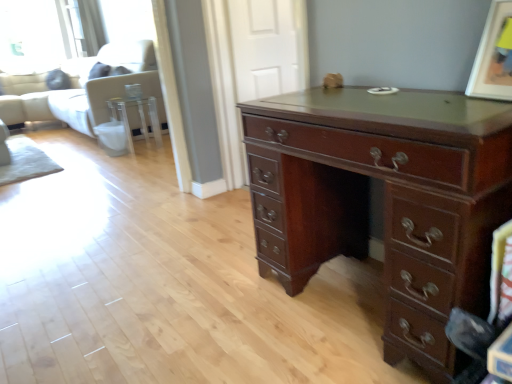
Question: Is clear glass side table at center taller than mahogany wood desk at center?

Choices:
 (A) yes
 (B) no

Answer: (B)

Question: Does clear glass side table at center have a larger size compared to mahogany wood desk at center?

Choices:
 (A) yes
 (B) no

Answer: (B)

Question: Considering the relative positions of clear glass side table at center and mahogany wood desk at center in the image provided, is clear glass side table at center behind mahogany wood desk at center?

Choices:
 (A) no
 (B) yes

Answer: (B)

Question: From the image's perspective, is clear glass side table at center located beneath mahogany wood desk at center?

Choices:
 (A) yes
 (B) no

Answer: (B)

Question: Is clear glass side table at center positioned before mahogany wood desk at center?

Choices:
 (A) yes
 (B) no

Answer: (B)

Question: From a real-world perspective, is matte brown picture frame at upper right positioned above or below mahogany wood desk at center?

Choices:
 (A) below
 (B) above

Answer: (B)

Question: Is point (483, 87) positioned closer to the camera than point (332, 193)?

Choices:
 (A) farther
 (B) closer

Answer: (B)

Question: Considering the relative positions of matte brown picture frame at upper right and mahogany wood desk at center in the image provided, is matte brown picture frame at upper right to the left or to the right of mahogany wood desk at center?

Choices:
 (A) left
 (B) right

Answer: (B)

Question: Is matte brown picture frame at upper right in front of or behind mahogany wood desk at center in the image?

Choices:
 (A) front
 (B) behind

Answer: (B)

Question: From a real-world perspective, is mahogany wood desk at center physically located above or below clear glass side table at center?

Choices:
 (A) below
 (B) above

Answer: (B)

Question: Is mahogany wood desk at center in front of or behind clear glass side table at center in the image?

Choices:
 (A) front
 (B) behind

Answer: (A)

Question: In the image, is mahogany wood desk at center on the left side or the right side of clear glass side table at center?

Choices:
 (A) right
 (B) left

Answer: (A)

Question: Which is correct: mahogany wood desk at center is inside clear glass side table at center, or outside of it?

Choices:
 (A) inside
 (B) outside

Answer: (B)

Question: Considering the positions of white fabric couch at upper left and matte brown picture frame at upper right in the image, is white fabric couch at upper left wider or thinner than matte brown picture frame at upper right?

Choices:
 (A) thin
 (B) wide

Answer: (B)

Question: From a real-world perspective, is white fabric couch at upper left above or below matte brown picture frame at upper right?

Choices:
 (A) above
 (B) below

Answer: (B)